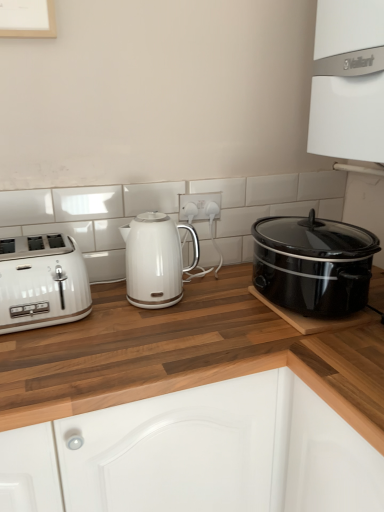
Question: Is white glossy toaster at left taller than white glossy kettle at center?

Choices:
 (A) no
 (B) yes

Answer: (A)

Question: From the image's perspective, is white glossy toaster at left beneath white glossy kettle at center?

Choices:
 (A) yes
 (B) no

Answer: (A)

Question: Does white glossy toaster at left have a larger size compared to white glossy kettle at center?

Choices:
 (A) no
 (B) yes

Answer: (B)

Question: Is white glossy toaster at left positioned with its back to white glossy kettle at center?

Choices:
 (A) no
 (B) yes

Answer: (A)

Question: From the image's perspective, would you say white glossy toaster at left is positioned over white glossy kettle at center?

Choices:
 (A) yes
 (B) no

Answer: (B)

Question: Is white glossy toaster at left taller or shorter than white glossy vaillant boiler at upper right?

Choices:
 (A) tall
 (B) short

Answer: (B)

Question: From the image's perspective, is white glossy toaster at left above or below white glossy vaillant boiler at upper right?

Choices:
 (A) above
 (B) below

Answer: (B)

Question: Is point (71, 263) positioned closer to the camera than point (319, 31)?

Choices:
 (A) closer
 (B) farther

Answer: (A)

Question: Choose the correct answer: Is white glossy toaster at left inside white glossy vaillant boiler at upper right or outside it?

Choices:
 (A) inside
 (B) outside

Answer: (B)

Question: Considering the positions of point (114, 339) and point (167, 226), is point (114, 339) closer or farther from the camera than point (167, 226)?

Choices:
 (A) farther
 (B) closer

Answer: (B)

Question: Do you think wooden at left is within white glossy kettle at center, or outside of it?

Choices:
 (A) outside
 (B) inside

Answer: (A)

Question: Is wooden at left to the left or to the right of white glossy kettle at center in the image?

Choices:
 (A) right
 (B) left

Answer: (B)

Question: Is wooden at left bigger or smaller than white glossy kettle at center?

Choices:
 (A) small
 (B) big

Answer: (B)

Question: Considering the positions of white plastic electric outlet at center and white glossy toaster at left in the image, is white plastic electric outlet at center taller or shorter than white glossy toaster at left?

Choices:
 (A) tall
 (B) short

Answer: (B)

Question: Relative to white glossy toaster at left, is white plastic electric outlet at center in front or behind?

Choices:
 (A) front
 (B) behind

Answer: (B)